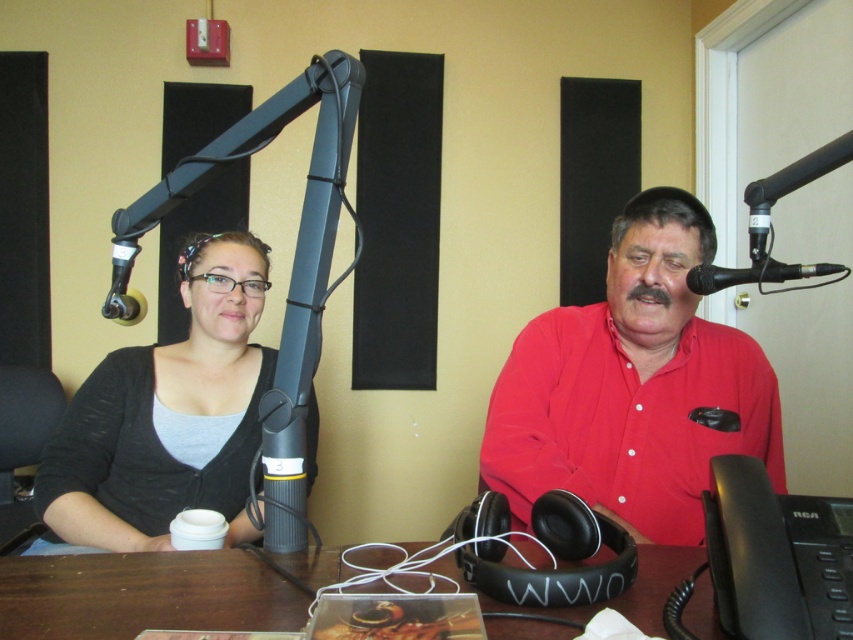
Which is above, brown wooden table at center or black matte microphone at upper right?

Positioned higher is black matte microphone at upper right.

Who is more forward, (508, 609) or (817, 268)?

Positioned in front is point (508, 609).

Which is behind, point (694, 628) or point (805, 288)?

The point (805, 288) is behind.

Find the location of a particular element. This screenshot has height=640, width=853. brown wooden table at center is located at coordinates (143, 595).

Is matte red shirt at center bigger than black matte microphone at upper right?

Indeed, matte red shirt at center has a larger size compared to black matte microphone at upper right.

Which is behind, point (672, 193) or point (701, 294)?

The point (672, 193) is behind.

Find the location of a particular element. matte red shirt at center is located at coordinates (633, 387).

Can you confirm if matte gray cardigan at left is smaller than brown wooden table at center?

No.

Where is `matte gray cardigan at left`? This screenshot has width=853, height=640. matte gray cardigan at left is located at coordinates (167, 417).

Find the location of a particular element. matte gray cardigan at left is located at coordinates (167, 417).